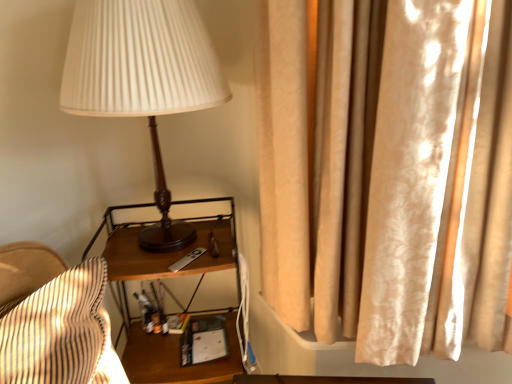
Question: From the image's perspective, is wooden nightstand at center under matte wood lamp at center?

Choices:
 (A) no
 (B) yes

Answer: (B)

Question: Is wooden nightstand at center positioned behind matte wood lamp at center?

Choices:
 (A) yes
 (B) no

Answer: (A)

Question: Is wooden nightstand at center taller than matte wood lamp at center?

Choices:
 (A) no
 (B) yes

Answer: (B)

Question: Is wooden nightstand at center wider than matte wood lamp at center?

Choices:
 (A) no
 (B) yes

Answer: (A)

Question: From a real-world perspective, is wooden nightstand at center on top of matte wood lamp at center?

Choices:
 (A) no
 (B) yes

Answer: (A)

Question: Is wooden nightstand at center bigger than matte wood lamp at center?

Choices:
 (A) yes
 (B) no

Answer: (A)

Question: Can you confirm if matte wood lamp at center is smaller than silky beige curtain at right?

Choices:
 (A) no
 (B) yes

Answer: (B)

Question: Can you confirm if matte wood lamp at center is taller than silky beige curtain at right?

Choices:
 (A) yes
 (B) no

Answer: (B)

Question: Is matte wood lamp at center behind silky beige curtain at right?

Choices:
 (A) no
 (B) yes

Answer: (B)

Question: Considering the relative positions of matte wood lamp at center and silky beige curtain at right in the image provided, is matte wood lamp at center to the left of silky beige curtain at right from the viewer's perspective?

Choices:
 (A) yes
 (B) no

Answer: (A)

Question: Considering the relative sizes of matte wood lamp at center and silky beige curtain at right in the image provided, is matte wood lamp at center thinner than silky beige curtain at right?

Choices:
 (A) yes
 (B) no

Answer: (B)

Question: Is matte wood lamp at center positioned with its back to silky beige curtain at right?

Choices:
 (A) yes
 (B) no

Answer: (B)

Question: Does wooden nightstand at center have a lesser width compared to silky beige curtain at right?

Choices:
 (A) no
 (B) yes

Answer: (A)